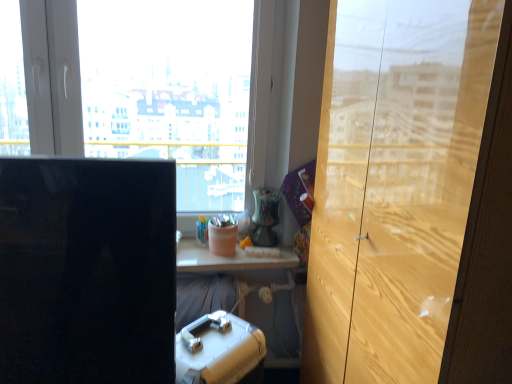
The width and height of the screenshot is (512, 384). I want to click on free space above white plastic suitcase at lower center, positioned as the 3th stationery in back-to-front order (from a real-world perspective), so click(x=208, y=344).